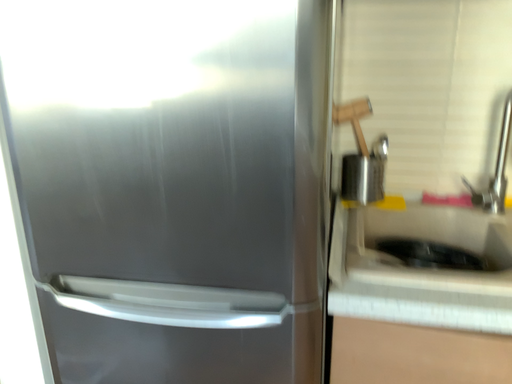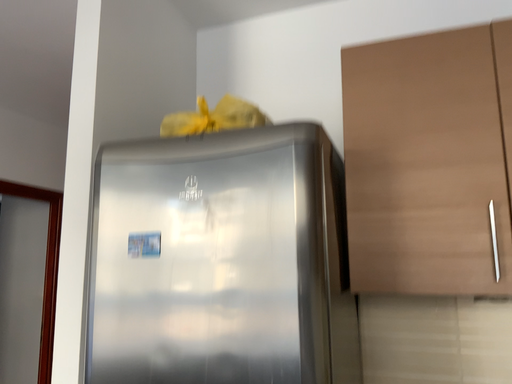
Question: How did the camera likely rotate when shooting the video?

Choices:
 (A) rotated left
 (B) rotated right

Answer: (A)